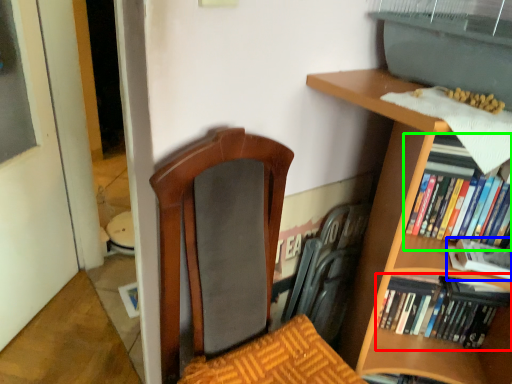
Question: Considering the real-world distances, which object is closest to book (highlighted by a red box)? book (highlighted by a blue box) or book (highlighted by a green box).

Choices:
 (A) book
 (B) book

Answer: (A)